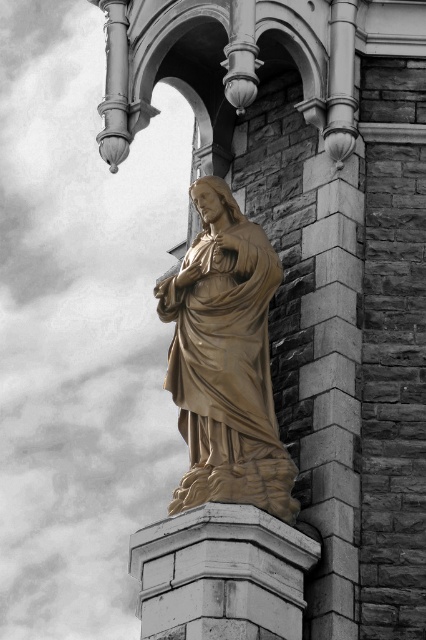
Question: Which point is closer to the camera?

Choices:
 (A) click(x=230, y=291)
 (B) click(x=166, y=541)

Answer: (B)

Question: Is gold polished stone statue at center in front of white stone pedestal at center?

Choices:
 (A) yes
 (B) no

Answer: (B)

Question: From the image, what is the correct spatial relationship of gold polished stone statue at center in relation to white stone pedestal at center?

Choices:
 (A) right
 (B) left

Answer: (A)

Question: Is gold polished stone statue at center to the right of white stone pedestal at center from the viewer's perspective?

Choices:
 (A) no
 (B) yes

Answer: (B)

Question: Which point is closer to the camera?

Choices:
 (A) (236, 236)
 (B) (222, 589)

Answer: (B)